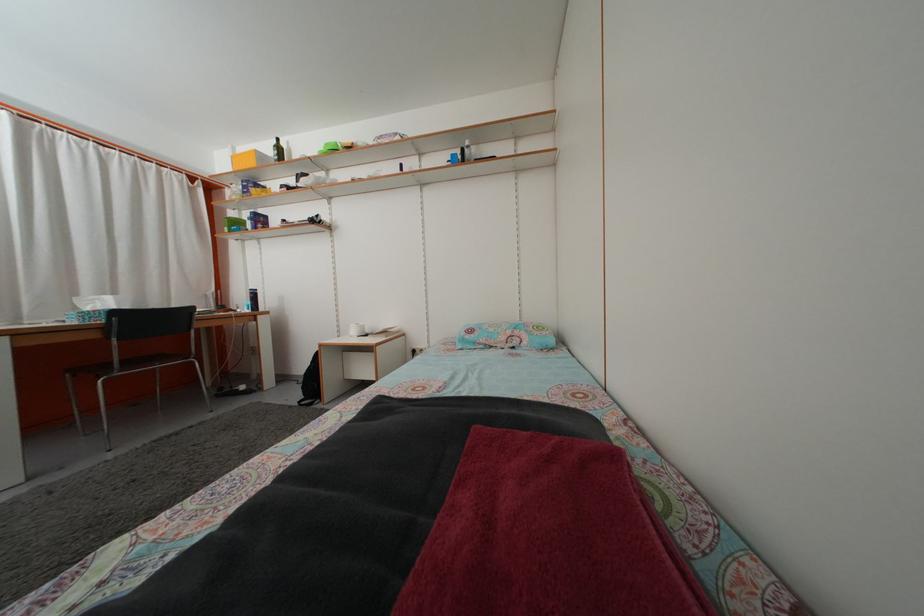
Where would you lift the black water bottle? Please return your answer as a coordinate pair (x, y).

(252, 300)